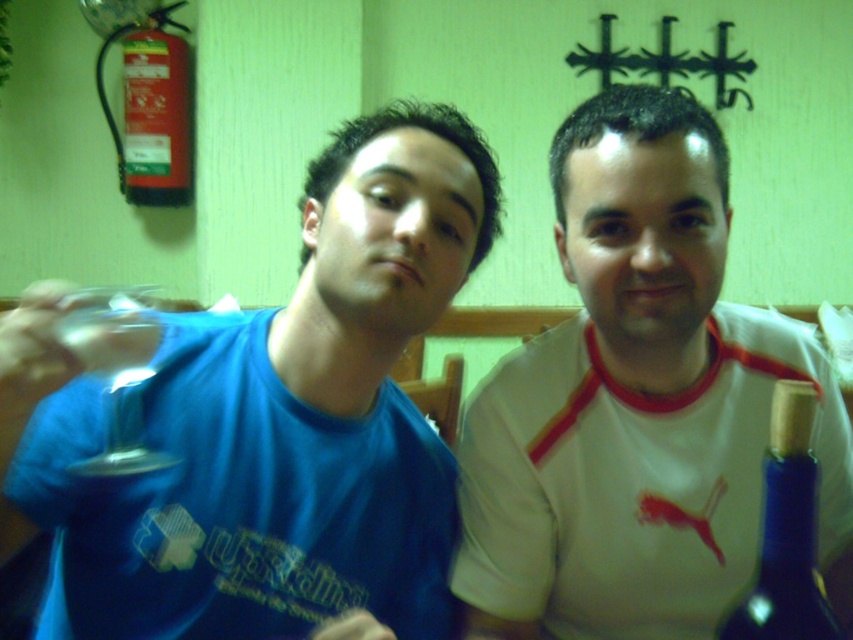
You are a person with a 12 inch long arm. You are sitting at a table and see a blue glass bottle at right. Can you reach it with your arm extended fully?

The blue glass bottle at right is 20.95 inches away from the viewer. Since your arm is only 12 inches long, you cannot reach it when fully extended.

You are at the bar and want to grab the blue glass bottle at right. Where exactly should you look to find it?

The blue glass bottle at right is located at point 0.833 on the x axis and 0.923 on the y axis.